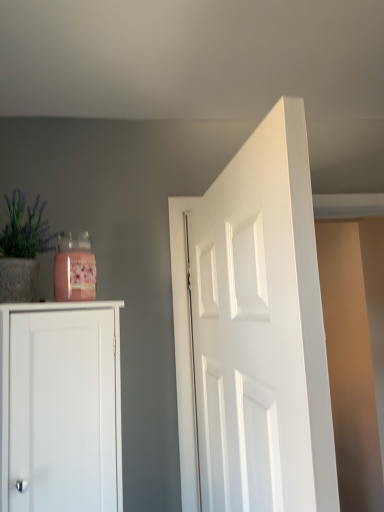
In the scene shown: Measure the distance between matte gray pot at left and camera.

The depth of matte gray pot at left is 38.84 inches.

The image size is (384, 512). Describe the element at coordinates (25, 229) in the screenshot. I see `matte gray pot at left` at that location.

This screenshot has height=512, width=384. What are the coordinates of `matte gray pot at left` in the screenshot? It's located at (25, 229).

The width and height of the screenshot is (384, 512). Describe the element at coordinates (254, 332) in the screenshot. I see `white smooth door at center` at that location.

Where is `white smooth door at center`? This screenshot has height=512, width=384. white smooth door at center is located at coordinates (254, 332).

What is the approximate height of white smooth door at center?

It is 34.64 inches.

What is the approximate width of white smooth door at center?

white smooth door at center is 5.35 inches in width.

Where is `matte gray pot at left`? The height and width of the screenshot is (512, 384). matte gray pot at left is located at coordinates (25, 229).

Which object is positioned more to the left, matte gray pot at left or white smooth door at center?

Positioned to the left is matte gray pot at left.

Is the position of matte gray pot at left less distant than that of white smooth door at center?

That is False.

Considering the points (17, 244) and (208, 240), which point is behind, point (17, 244) or point (208, 240)?

The point (208, 240) is farther.

From the image's perspective, is matte gray pot at left above white smooth door at center?

Yes, from the image's perspective, matte gray pot at left is over white smooth door at center.

From a real-world perspective, is matte gray pot at left on white smooth door at center?

Yes, from a real-world perspective, matte gray pot at left is over white smooth door at center

Does matte gray pot at left have a lesser width compared to white smooth door at center?

No.

Considering the sizes of objects matte gray pot at left and white smooth door at center in the image provided, who is taller, matte gray pot at left or white smooth door at center?

white smooth door at center is taller.

Considering the relative sizes of matte gray pot at left and white smooth door at center in the image provided, is matte gray pot at left smaller than white smooth door at center?

Correct, matte gray pot at left occupies less space than white smooth door at center.

Is matte gray pot at left outside of white smooth door at center?

Yes, matte gray pot at left is located beyond the bounds of white smooth door at center.

Is matte gray pot at left directly adjacent to white smooth door at center?

No, matte gray pot at left is not making contact with white smooth door at center.

Could you tell me if matte gray pot at left is turned towards white smooth door at center?

Yes, matte gray pot at left is aimed at white smooth door at center.

How different are the orientations of matte gray pot at left and white smooth door at center in degrees?

There is a 52.1-degree angle between the facing directions of matte gray pot at left and white smooth door at center.

This screenshot has height=512, width=384. Identify the location of door in front of the matte gray pot at left. (254, 332).

Which is more to the right, white smooth door at center or matte gray pot at left?

From the viewer's perspective, white smooth door at center appears more on the right side.

Considering the positions of objects white smooth door at center and matte gray pot at left in the image provided, who is in front, white smooth door at center or matte gray pot at left?

white smooth door at center is more forward.

Between point (246, 165) and point (13, 204), which one is positioned behind?

The point (13, 204) is more distant.

From the image's perspective, between white smooth door at center and matte gray pot at left, who is located below?

white smooth door at center.

From a real-world perspective, is white smooth door at center physically below matte gray pot at left?

Yes.

Can you confirm if white smooth door at center is thinner than matte gray pot at left?

Indeed, white smooth door at center has a lesser width compared to matte gray pot at left.

Can you confirm if white smooth door at center is taller than matte gray pot at left?

Indeed, white smooth door at center has a greater height compared to matte gray pot at left.

Can you confirm if white smooth door at center is smaller than matte gray pot at left?

Actually, white smooth door at center might be larger than matte gray pot at left.

Is white smooth door at center outside of matte gray pot at left?

white smooth door at center is positioned outside matte gray pot at left.

Is white smooth door at center far from matte gray pot at left?

That's not correct — white smooth door at center is a little close to matte gray pot at left.

Is white smooth door at center aimed at matte gray pot at left?

No, white smooth door at center is not aimed at matte gray pot at left.

How different are the orientations of white smooth door at center and matte gray pot at left in degrees?

The facing directions of white smooth door at center and matte gray pot at left are 52.1 degrees apart.

How much distance is there between white smooth door at center and matte gray pot at left?

white smooth door at center and matte gray pot at left are 21.04 inches apart from each other.

In order to click on door below the matte gray pot at left (from a real-world perspective) in this screenshot , I will do `click(254, 332)`.

This screenshot has height=512, width=384. Identify the location of plant behind the white smooth door at center. (25, 229).

Find the location of a particular element. door on the right side of matte gray pot at left is located at coordinates (254, 332).